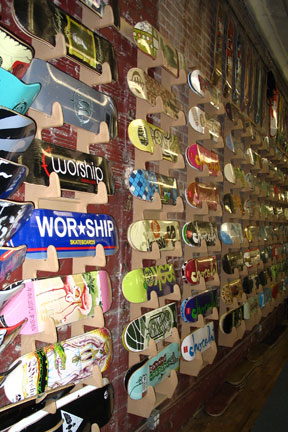
The image size is (288, 432). What are the coordinates of `upper wall trim` in the screenshot? It's located at (283, 58), (259, 6).